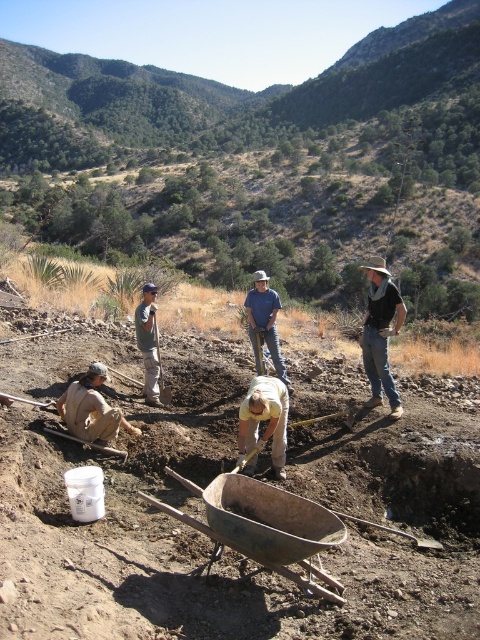
Question: Estimate the real-world distances between objects in this image. Which object is farther from the brown soil at center?

Choices:
 (A) yellow fabric shirt at center
 (B) brushed metal shovel at lower center

Answer: (B)

Question: Does blue denim shirt at center have a greater width compared to light gray denim jeans at center?

Choices:
 (A) yes
 (B) no

Answer: (A)

Question: Is yellow fabric shirt at center below light gray denim jeans at center?

Choices:
 (A) yes
 (B) no

Answer: (A)

Question: Which point appears closest to the camera in this image?

Choices:
 (A) (123, 452)
 (B) (374, 349)
 (C) (264, 403)

Answer: (C)

Question: Can you confirm if black leather cowboy hat at right is wider than blue denim shirt at center?

Choices:
 (A) no
 (B) yes

Answer: (B)

Question: Considering the real-world distances, which object is farthest from the yellow fabric shirt at center?

Choices:
 (A) blue denim shirt at center
 (B) brushed metal shovel at lower left
 (C) brown soil at center

Answer: (A)